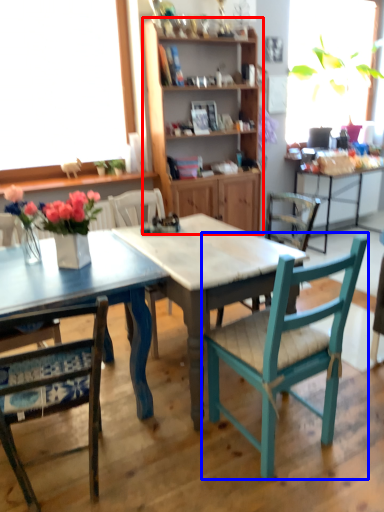
Question: Among these objects, which one is farthest to the camera, cabinetry (highlighted by a red box) or chair (highlighted by a blue box)?

Choices:
 (A) cabinetry
 (B) chair

Answer: (A)